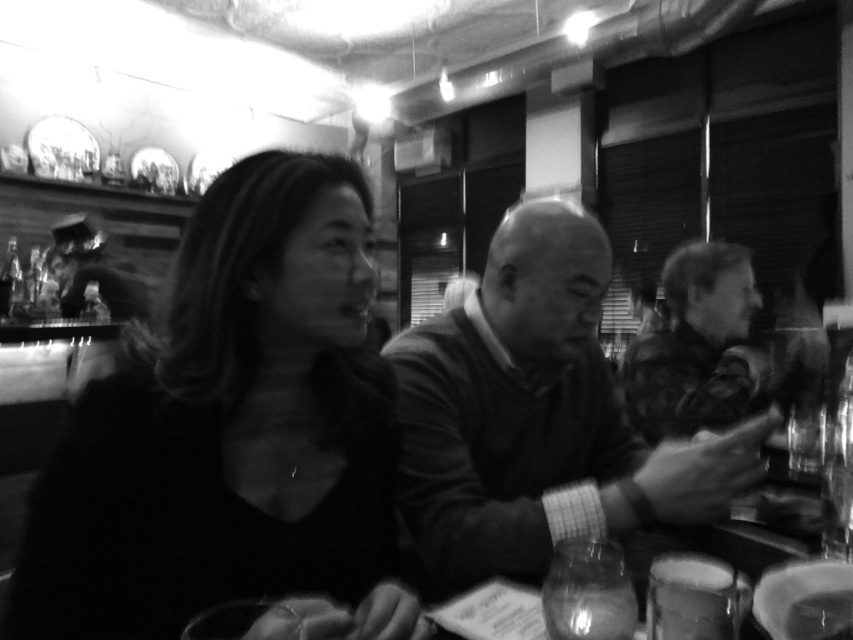
Question: Among these objects, which one is nearest to the camera?

Choices:
 (A) smooth black shirt at center
 (B) camouflage jacket at right

Answer: (A)

Question: Does smooth black shirt at center appear on the right side of smooth sweater at center?

Choices:
 (A) yes
 (B) no

Answer: (B)

Question: Which of the following is the closest to the observer?

Choices:
 (A) smooth black shirt at center
 (B) smooth sweater at center

Answer: (A)

Question: Is smooth black shirt at center above camouflage jacket at right?

Choices:
 (A) no
 (B) yes

Answer: (B)

Question: Does smooth black shirt at center appear on the right side of smooth sweater at center?

Choices:
 (A) yes
 (B) no

Answer: (B)

Question: Which point is farther to the camera?

Choices:
 (A) (693, 412)
 (B) (567, 506)
 (C) (225, 524)

Answer: (A)